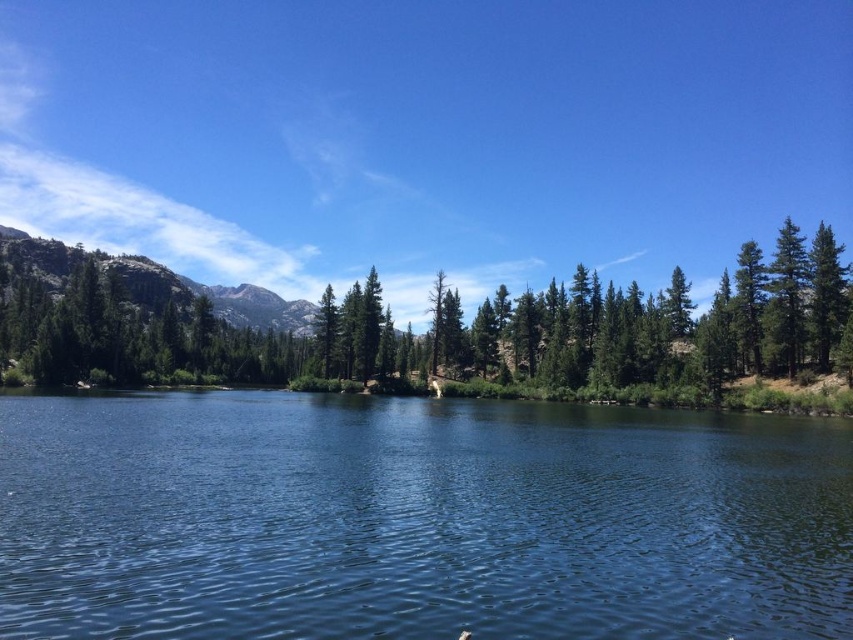
You are a hiker planning to cross the clear blue water at center to reach the rugged granite mountain at left. Based on the scene, is the mountain located behind or in front of the water?

The rugged granite mountain at left is positioned behind the clear blue water at center, so the mountain is behind the water.

You are an outdoor enthusiast planning to hike to the rugged granite mountain at left. From your current position at the clear blue water at center, which direction should you head to reach the mountain?

Since the clear blue water at center is positioned on the right side of rugged granite mountain at left, you should head to the left to reach the mountain.